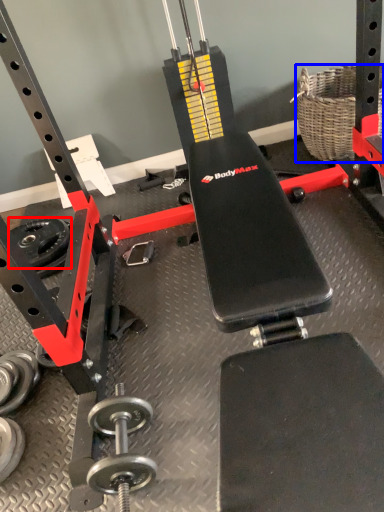
Question: Among these objects, which one is nearest to the camera, wheel (highlighted by a red box) or basket (highlighted by a blue box)?

Choices:
 (A) wheel
 (B) basket

Answer: (B)